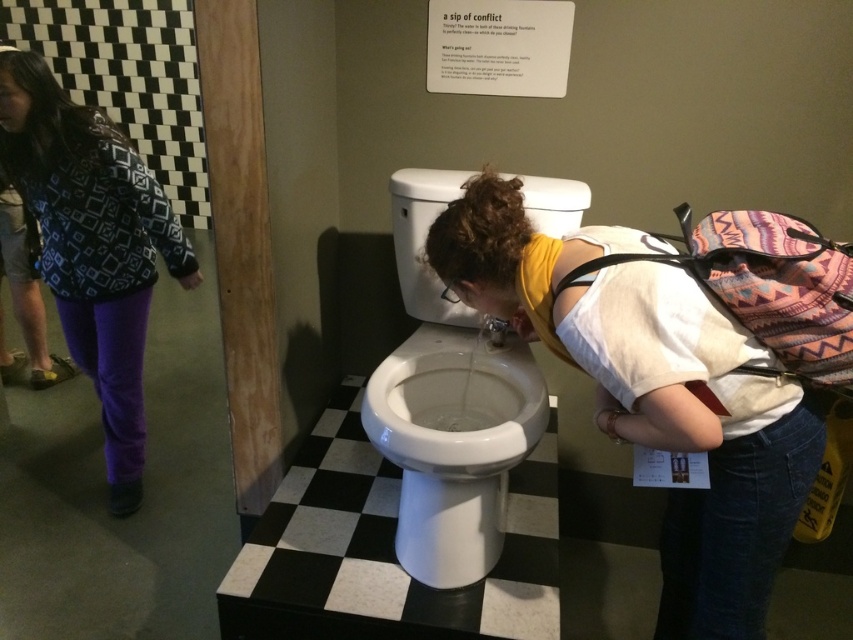
Question: Which point is closer to the camera?

Choices:
 (A) white glossy toilet bowl at center
 (B) white glossy toilet at center
 (C) patterned fabric jacket at left

Answer: (B)

Question: Can you confirm if white glossy toilet at center is smaller than patterned fabric jacket at left?

Choices:
 (A) yes
 (B) no

Answer: (A)

Question: Is white glossy toilet at center to the right of patterned fabric jacket at left from the viewer's perspective?

Choices:
 (A) yes
 (B) no

Answer: (A)

Question: Which object is the closest to the white glossy toilet at center?

Choices:
 (A) white glossy toilet bowl at center
 (B) patterned fabric jacket at left

Answer: (A)

Question: Which point is farther from the camera taking this photo?

Choices:
 (A) (135, 440)
 (B) (711, 508)
 (C) (474, 401)

Answer: (A)

Question: Can you confirm if white glossy toilet bowl at center is positioned above patterned fabric jacket at left?

Choices:
 (A) yes
 (B) no

Answer: (B)